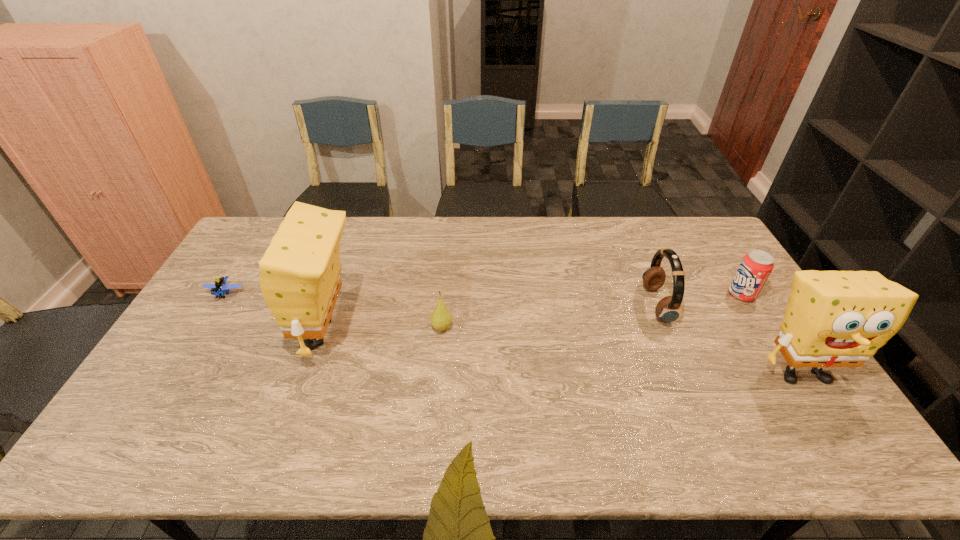
Please point a location where one more sponge can be added evenly. Please provide its 2D coordinates. Your answer should be formatted as a tuple, i.e. [(x, y)], where the tuple contains the x and y coordinates of a point satisfying the conditions above.

[(553, 352)]